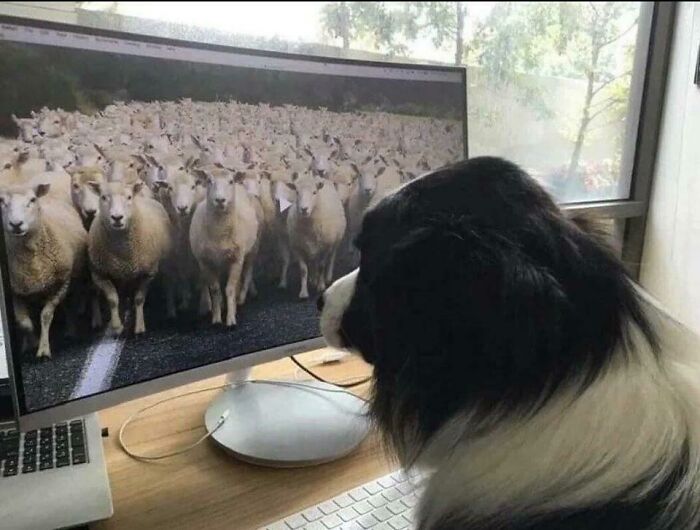
Identify the location of window. This screenshot has width=700, height=530. (554, 74).